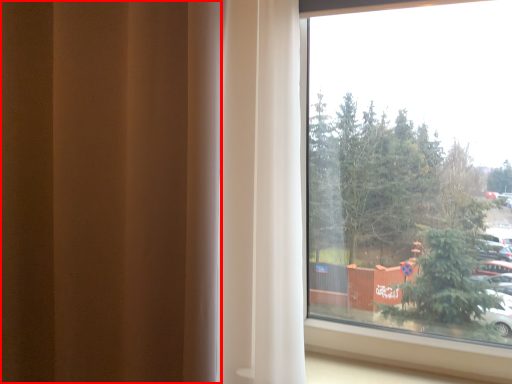
Question: From the image, what is the correct spatial relationship of curtain (annotated by the red box) in relation to window?

Choices:
 (A) right
 (B) left

Answer: (B)